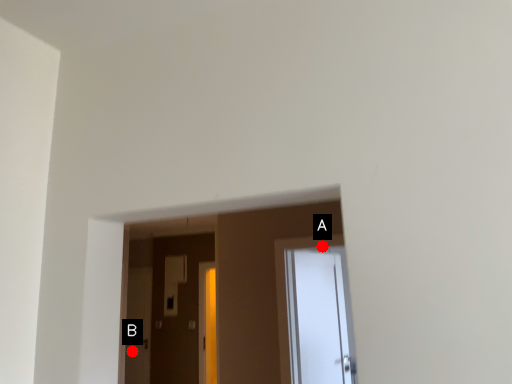
Question: Two points are circled on the image, labeled by A and B beside each circle. Which point appears closest to the camera in this image?

Choices:
 (A) A is closer
 (B) B is closer

Answer: (A)